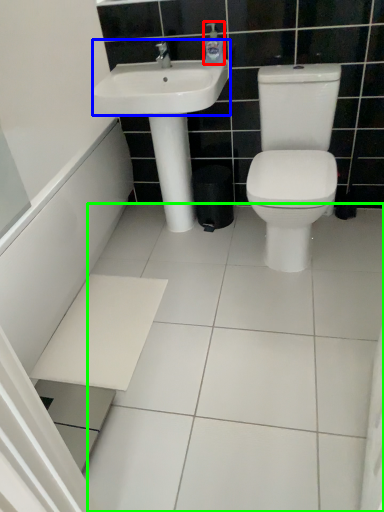
Question: Based on their relative distances, which object is farther from soap dispenser (highlighted by a red box)? Choose from sink (highlighted by a blue box) and ceramic tile (highlighted by a green box).

Choices:
 (A) sink
 (B) ceramic tile

Answer: (B)